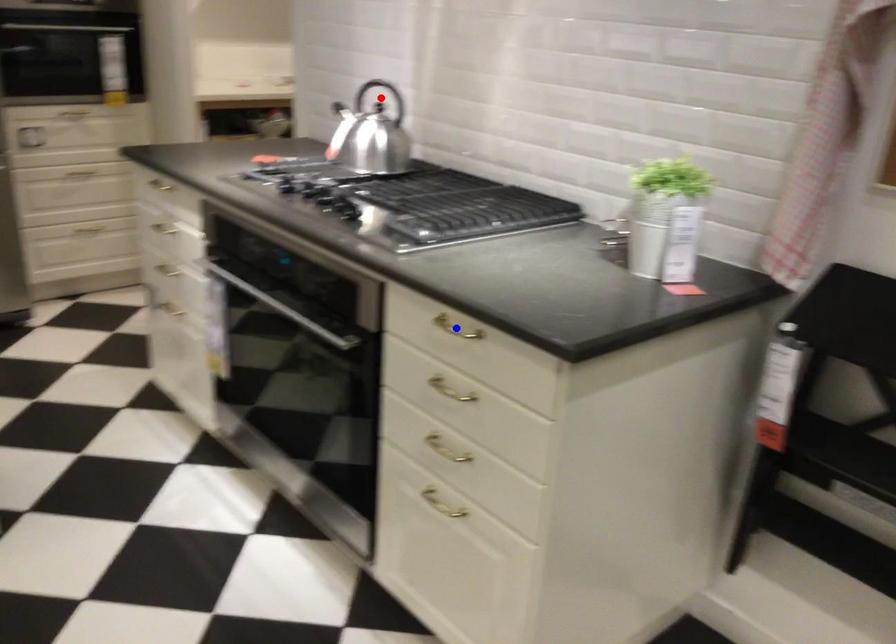
Question: Which of the two points in the image is closer to the camera?

Choices:
 (A) Blue point is closer.
 (B) Red point is closer.

Answer: (A)